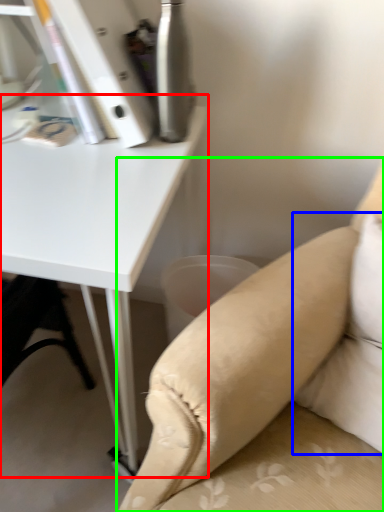
Question: Based on their relative distances, which object is nearer to table (highlighted by a red box)? Choose from pillow (highlighted by a blue box) and studio couch (highlighted by a green box).

Choices:
 (A) pillow
 (B) studio couch

Answer: (B)